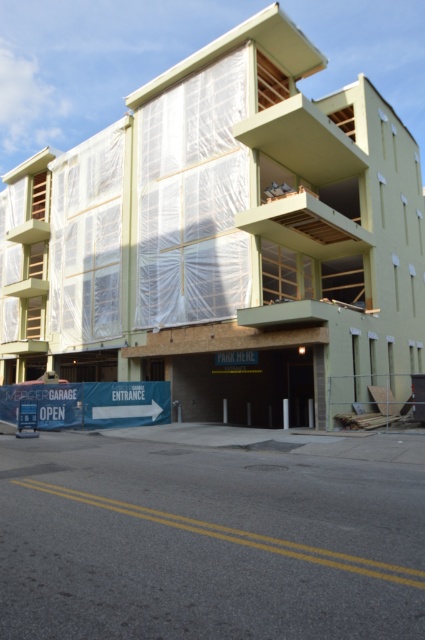
Question: Where is green plastic building at center located in relation to concrete pavement at lower center in the image?

Choices:
 (A) above
 (B) below

Answer: (A)

Question: Does green plastic building at center appear under concrete pavement at lower center?

Choices:
 (A) no
 (B) yes

Answer: (A)

Question: Among these points, which one is farthest from the camera?

Choices:
 (A) (422, 240)
 (B) (269, 602)

Answer: (A)

Question: Does green plastic building at center have a smaller size compared to concrete pavement at lower center?

Choices:
 (A) yes
 (B) no

Answer: (B)